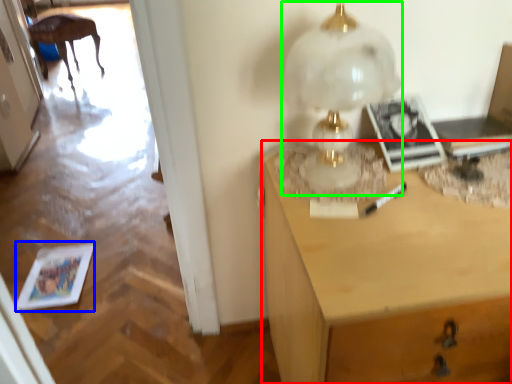
Question: Estimate the real-world distances between objects in this image. Which object is closer to desk (highlighted by a red box), magazine (highlighted by a blue box) or table lamp (highlighted by a green box)?

Choices:
 (A) magazine
 (B) table lamp

Answer: (B)